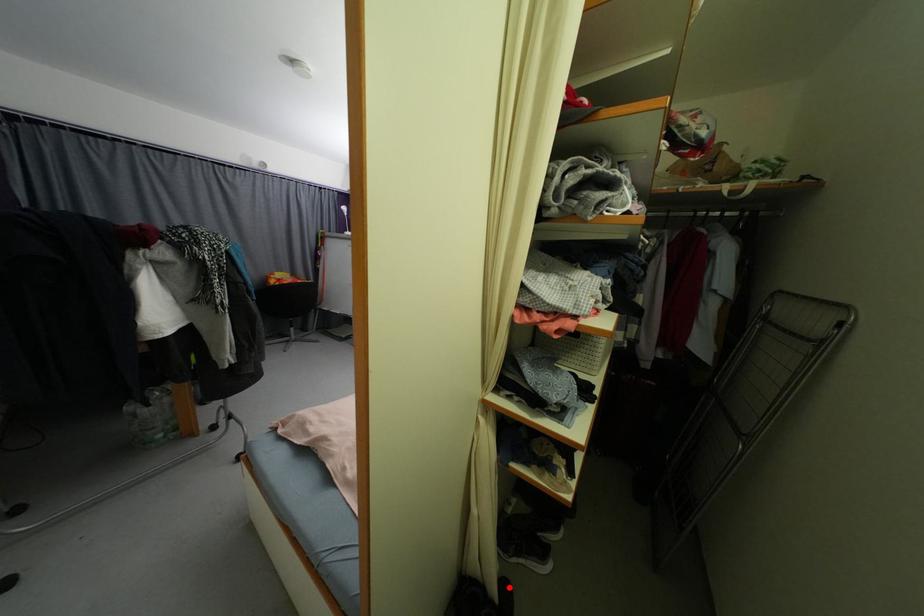
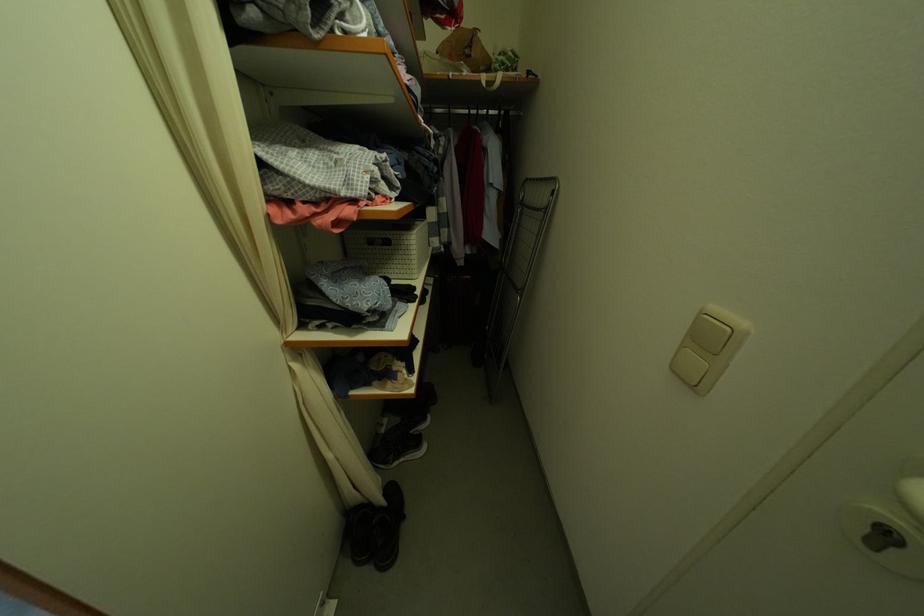
Locate, in the second image, the point that corresponds to the highlighted location in the first image.

(395, 490)